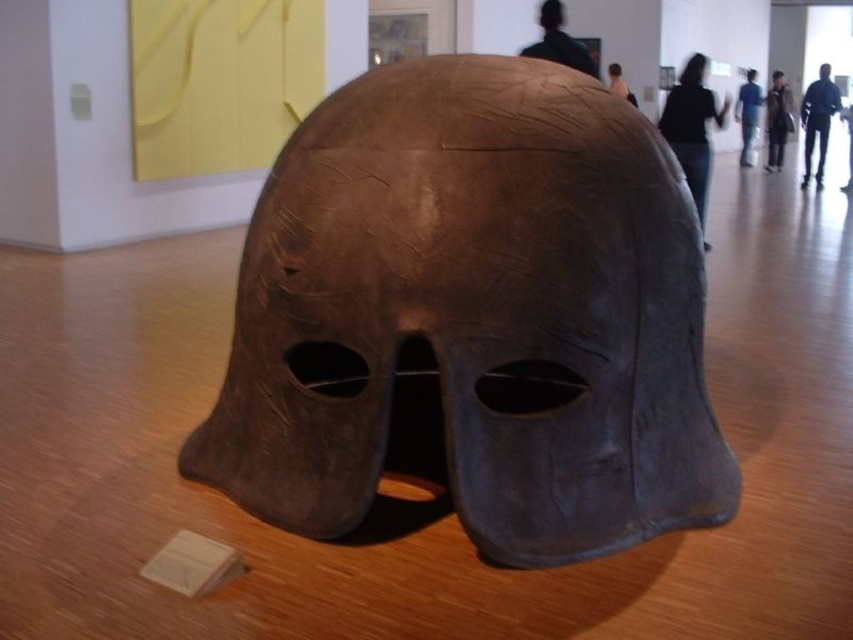
Who is positioned more to the right, brown matte helmet at center or brown leather jacket at upper right?

brown leather jacket at upper right is more to the right.

Measure the distance between brown matte helmet at center and brown leather jacket at upper right.

brown matte helmet at center is 10.06 meters from brown leather jacket at upper right.

Between point (286, 400) and point (788, 113), which one is positioned in front?

Point (286, 400) is in front.

The width and height of the screenshot is (853, 640). I want to click on brown matte helmet at center, so click(473, 317).

Which is behind, point (828, 124) or point (573, 44)?

Positioned behind is point (828, 124).

Is black leather jacket at upper right bigger than black leather mask at upper center?

Yes.

Is point (825, 72) farther from viewer compared to point (547, 17)?

Yes, point (825, 72) is farther from viewer.

In order to click on black leather jacket at upper right in this screenshot , I will do `click(817, 120)`.

Is black matte jacket at upper center shorter than brown leather jacket at upper right?

Indeed, black matte jacket at upper center has a lesser height compared to brown leather jacket at upper right.

Measure the distance between point [723,112] and camera.

Point [723,112] is 20.53 feet from camera.

The image size is (853, 640). I want to click on black matte jacket at upper center, so point(692,128).

The height and width of the screenshot is (640, 853). I want to click on black matte jacket at upper center, so click(692, 128).